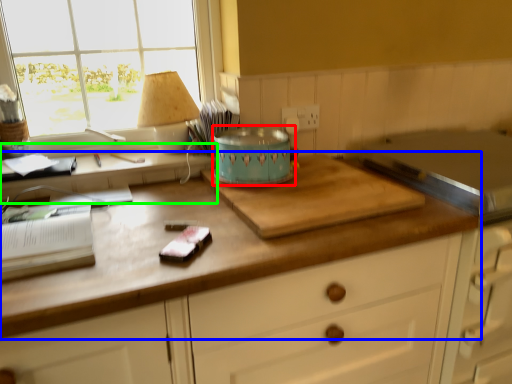
Question: Which object is positioned farthest from appliance (highlighted by a red box)? Select from countertop (highlighted by a blue box) and computer desk (highlighted by a green box).

Choices:
 (A) countertop
 (B) computer desk

Answer: (A)